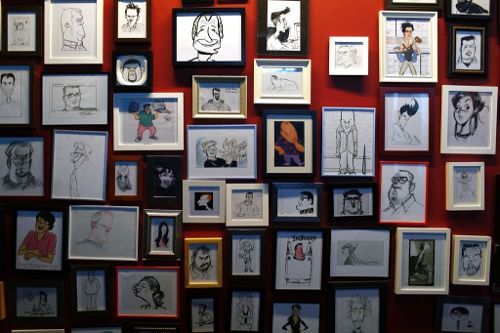
At what (x,y) coordinates should I click in order to perform the action: click on white frames. Please return your answer as a coordinate pair (x, y). Image resolution: width=500 pixels, height=333 pixels. Looking at the image, I should click on (284, 79), (201, 199), (408, 44), (67, 19), (478, 245), (461, 191), (468, 113), (349, 48).